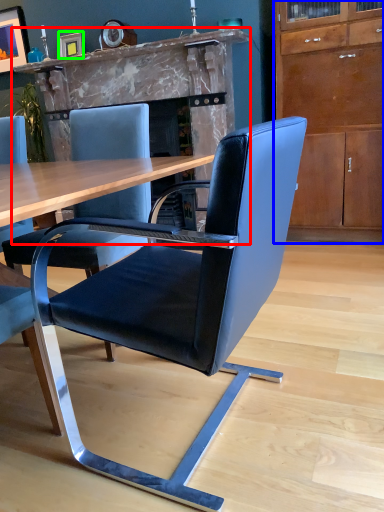
Question: Which is nearer to the fireplace (highlighted by a red box)? cabinetry (highlighted by a blue box) or picture frame (highlighted by a green box).

Choices:
 (A) cabinetry
 (B) picture frame

Answer: (B)